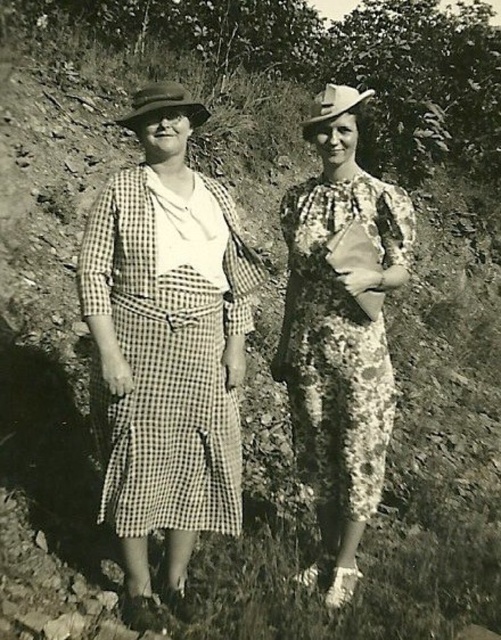
You are standing in a rural area and see the checkered fabric dress at center. If you want to reach it within 3 seconds, what is the minimum speed you need to move at?

The checkered fabric dress at center is 9.02 feet away. To cover this distance in 3 seconds, you would need to move at a minimum speed of approximately 3.01 feet per second.